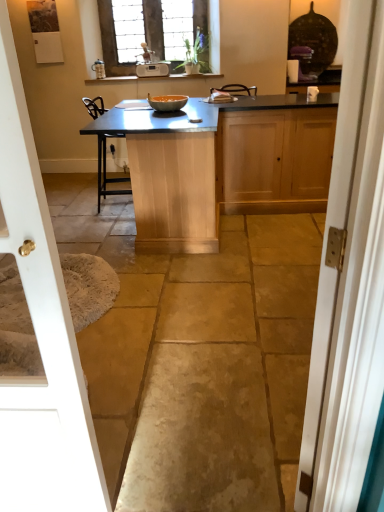
Locate an element on the screen. The image size is (384, 512). vacant region to the left of white painted wood door at right, which is the 2th door from left to right is located at coordinates (238, 442).